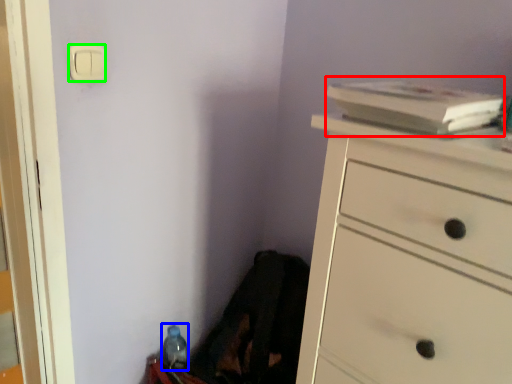
Question: Based on their relative distances, which object is farther from book (highlighted by a red box)? Choose from bottle (highlighted by a blue box) and light switch (highlighted by a green box).

Choices:
 (A) bottle
 (B) light switch

Answer: (A)